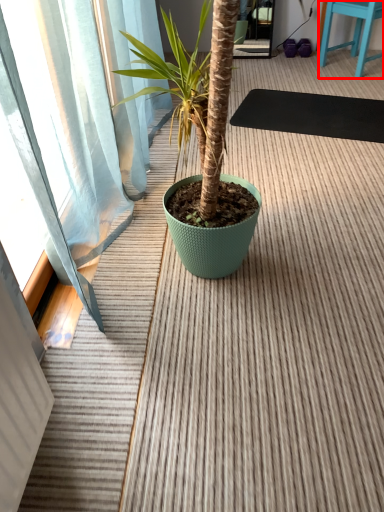
Question: From the image's perspective, where is furniture (annotated by the red box) located in relation to yoga mat in the image?

Choices:
 (A) below
 (B) above

Answer: (B)